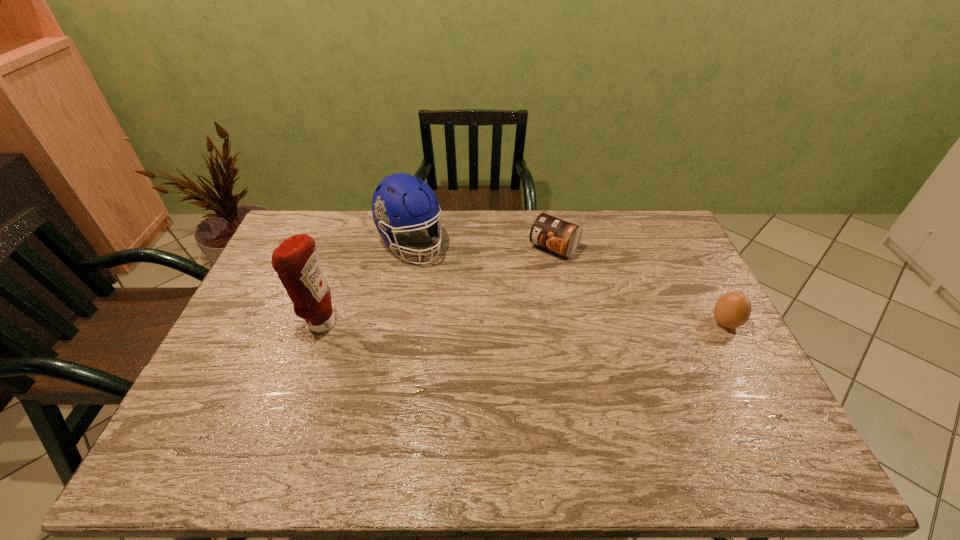
Locate an element on the screen. The image size is (960, 540). vacant area that lies between the rightmost object and the condiment is located at coordinates (522, 323).

Locate an element on the screen. This screenshot has width=960, height=540. free point between the football helmet and the boiled egg is located at coordinates (568, 284).

Where is `the third closest object to the leftmost object`? The height and width of the screenshot is (540, 960). the third closest object to the leftmost object is located at coordinates (733, 309).

Locate which object is the third closest to the second object from right to left. Please provide its 2D coordinates. Your answer should be formatted as a tuple, i.e. [(x, y)], where the tuple contains the x and y coordinates of a point satisfying the conditions above.

[(296, 261)]

Identify the location of free location that satisfies the following two spatial constraints: 1. on the back side of the condiment; 2. on the left side of the can. This screenshot has height=540, width=960. (347, 247).

Locate an element on the screen. vacant space that satisfies the following two spatial constraints: 1. on the back side of the condiment; 2. on the right side of the boiled egg is located at coordinates (320, 323).

Locate an element on the screen. Image resolution: width=960 pixels, height=540 pixels. vacant space that satisfies the following two spatial constraints: 1. on the front side of the second object from right to left; 2. on the right side of the football helmet is located at coordinates (410, 247).

I want to click on free region that satisfies the following two spatial constraints: 1. on the front side of the boiled egg; 2. on the left side of the can, so click(x=568, y=323).

I want to click on free spot that satisfies the following two spatial constraints: 1. on the front side of the boiled egg; 2. on the left side of the second object from left to right, so click(396, 323).